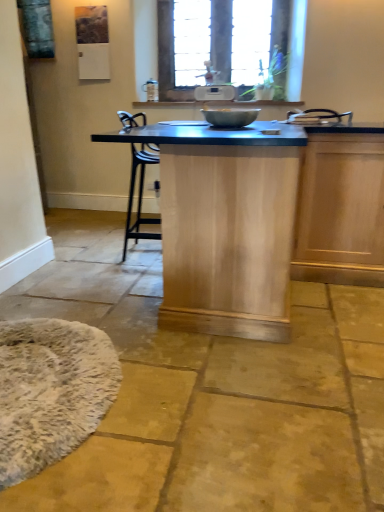
At what (x,y) coordinates should I click in order to perform the action: click on free spot to the left of natural wood table at center. Please return your answer as a coordinate pair (x, y). The width and height of the screenshot is (384, 512). Looking at the image, I should click on (89, 269).